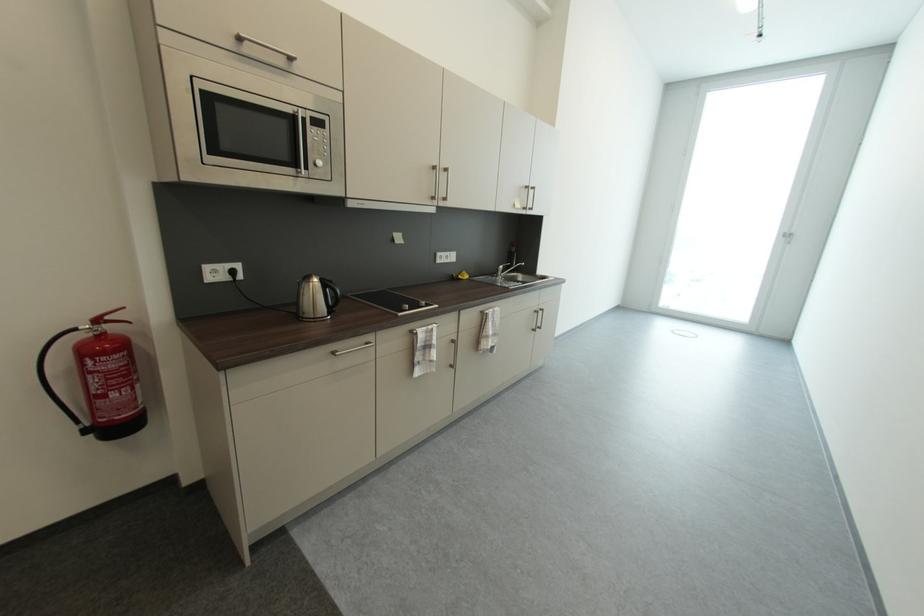
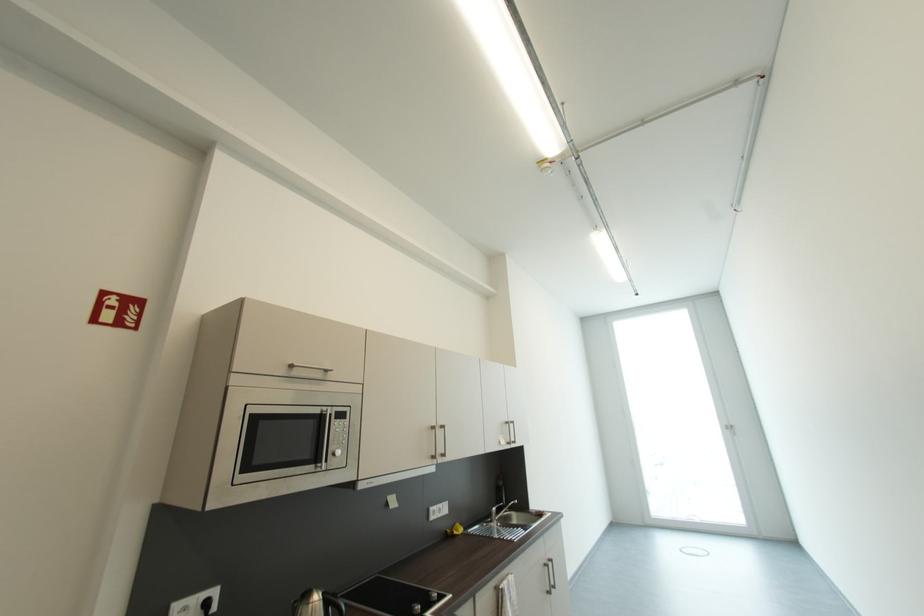
Where in the second image is the point corresponding to point 246,39 from the first image?

(298, 368)